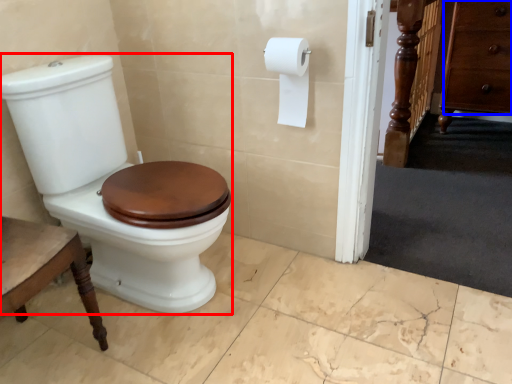
Question: Which point is further to the camera, porcelain (highlighted by a red box) or drawer (highlighted by a blue box)?

Choices:
 (A) porcelain
 (B) drawer

Answer: (B)